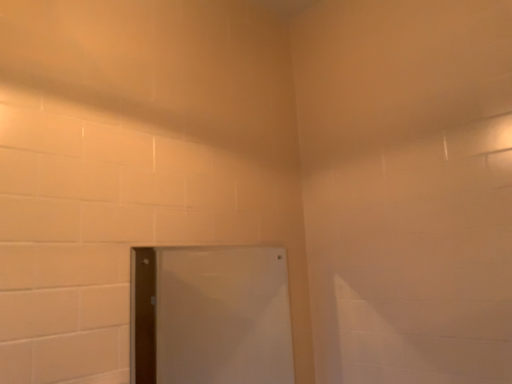
What is the approximate height of white glossy door at center?

white glossy door at center is 18.37 inches tall.

I want to click on white glossy door at center, so click(210, 315).

What do you see at coordinates (210, 315) in the screenshot?
I see `white glossy door at center` at bounding box center [210, 315].

Find the location of a particular element. This screenshot has width=512, height=384. white glossy door at center is located at coordinates (210, 315).